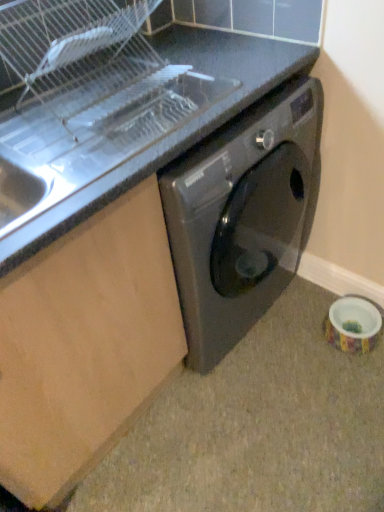
Question: Does metallic stainless steel sink at upper left come in front of matte gray granite at lower right?

Choices:
 (A) yes
 (B) no

Answer: (A)

Question: Is metallic stainless steel sink at upper left facing away from matte gray granite at lower right?

Choices:
 (A) yes
 (B) no

Answer: (B)

Question: Would you say metallic stainless steel sink at upper left is outside matte gray granite at lower right?

Choices:
 (A) yes
 (B) no

Answer: (A)

Question: Considering the relative sizes of metallic stainless steel sink at upper left and matte gray granite at lower right in the image provided, is metallic stainless steel sink at upper left bigger than matte gray granite at lower right?

Choices:
 (A) yes
 (B) no

Answer: (A)

Question: Does metallic stainless steel sink at upper left have a lesser width compared to matte gray granite at lower right?

Choices:
 (A) yes
 (B) no

Answer: (A)

Question: From a real-world perspective, is metallic stainless steel sink at upper left positioned under matte gray granite at lower right based on gravity?

Choices:
 (A) no
 (B) yes

Answer: (A)

Question: From a real-world perspective, is matte gray granite at lower right positioned over metallic stainless steel sink at upper left based on gravity?

Choices:
 (A) no
 (B) yes

Answer: (A)

Question: Considering the relative sizes of matte gray granite at lower right and metallic stainless steel sink at upper left in the image provided, is matte gray granite at lower right bigger than metallic stainless steel sink at upper left?

Choices:
 (A) yes
 (B) no

Answer: (B)

Question: From a real-world perspective, is matte gray granite at lower right below metallic stainless steel sink at upper left?

Choices:
 (A) yes
 (B) no

Answer: (A)

Question: Considering the relative sizes of matte gray granite at lower right and metallic stainless steel sink at upper left in the image provided, is matte gray granite at lower right wider than metallic stainless steel sink at upper left?

Choices:
 (A) no
 (B) yes

Answer: (B)

Question: Is metallic stainless steel sink at upper left a part of matte gray granite at lower right?

Choices:
 (A) no
 (B) yes

Answer: (A)

Question: Can you confirm if matte gray granite at lower right is smaller than metallic stainless steel sink at upper left?

Choices:
 (A) no
 (B) yes

Answer: (B)

Question: From the image's perspective, relative to matte gray granite at lower right, is metallic stainless steel sink at upper left above or below?

Choices:
 (A) above
 (B) below

Answer: (A)